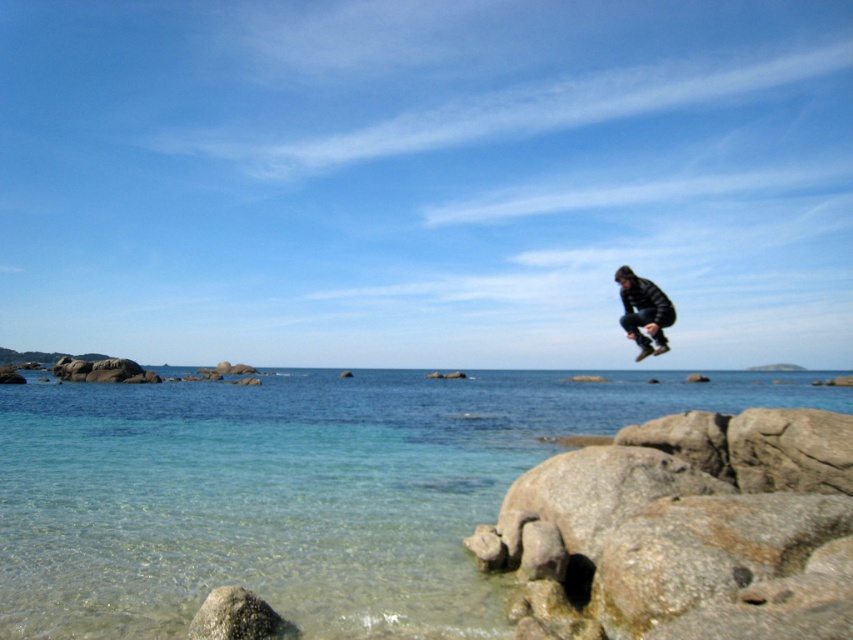
Question: From the image, what is the correct spatial relationship of gray rough rock at lower right in relation to dark blue jacket at center?

Choices:
 (A) above
 (B) below

Answer: (B)

Question: Is clear water at lower left to the right of dark blue jacket at center from the viewer's perspective?

Choices:
 (A) yes
 (B) no

Answer: (B)

Question: Which object appears farthest from the camera in this image?

Choices:
 (A) gray rock at lower left
 (B) dark blue jacket at center

Answer: (B)

Question: Which object is closer to the camera taking this photo?

Choices:
 (A) gray rough rock at lower right
 (B) dark blue jacket at center

Answer: (A)

Question: Which of the following is the farthest from the observer?

Choices:
 (A) (274, 413)
 (B) (608, 451)
 (C) (654, 312)

Answer: (A)

Question: From the image, what is the correct spatial relationship of clear water at lower left in relation to dark blue jacket at center?

Choices:
 (A) left
 (B) right

Answer: (A)